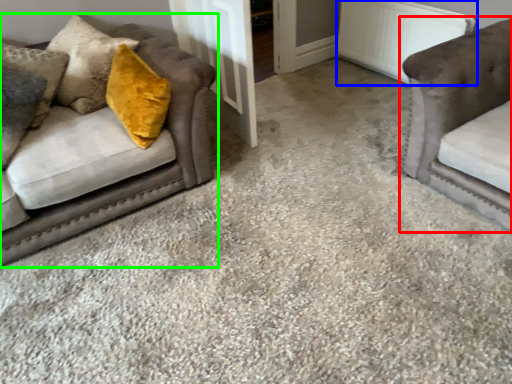
Question: Which object is positioned farthest from studio couch (highlighted by a red box)? Select from radiator (highlighted by a blue box) and studio couch (highlighted by a green box).

Choices:
 (A) radiator
 (B) studio couch

Answer: (B)